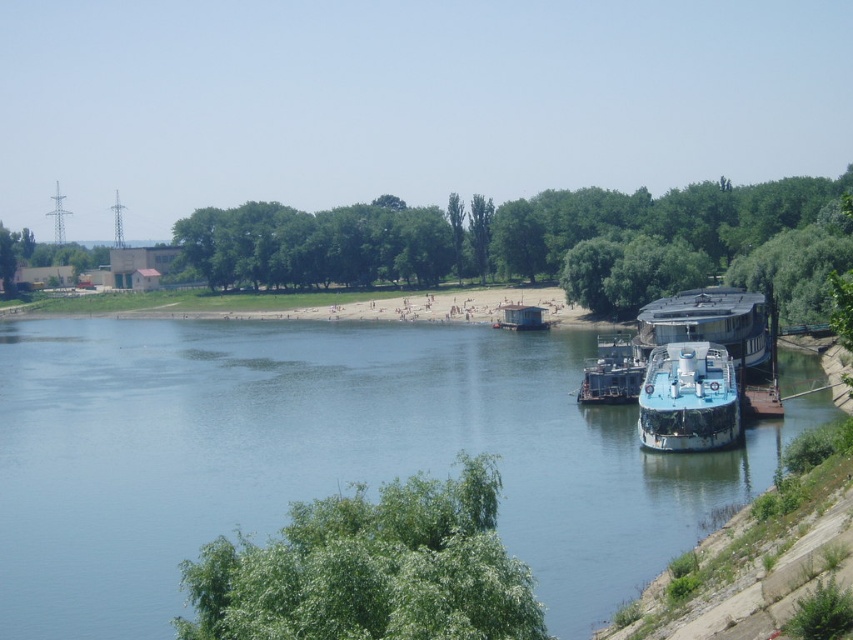
You are standing at the center of the image and want to locate the green leafy tree at lower center. Which direction should you look to find it?

The green leafy tree at lower center is located at point (x=370, y=570), so you should look downward and to the right from the center to find it.

You are a park ranger planning to plant a new tree between the two green leafy trees at center. The new tree requires 100 meters of space between the existing trees to grow properly. Based on the scene, will there be enough space?

The two green leafy trees at center are 97.45 meters apart, which is less than the required 100 meters. Therefore, there is not enough space for the new tree to grow properly.

You are standing at the riverside and see two points marked in the image. Which point is closer to you, point (425, 257) or point (648, 316)?

Point (425, 257) is closer to you because it is further to the viewer than point (648, 316).